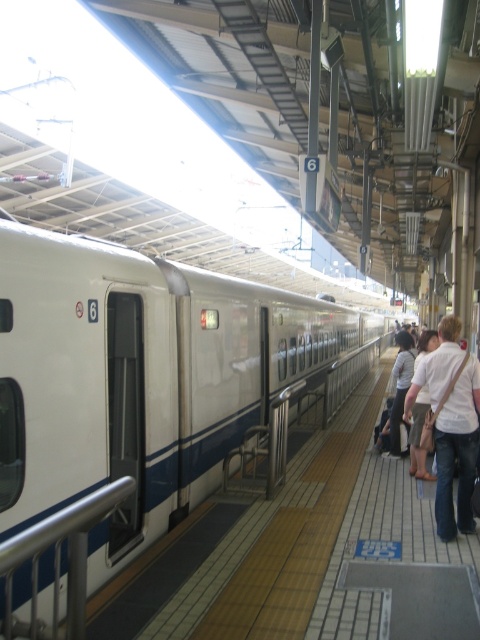
Question: Among these objects, which one is nearest to the camera?

Choices:
 (A) silver metallic rail at lower left
 (B) white glossy train at center
 (C) white cotton shirt at right

Answer: (A)

Question: Is white glossy train at center to the right of silver metallic rail at lower left from the viewer's perspective?

Choices:
 (A) no
 (B) yes

Answer: (A)

Question: Which of the following is the closest to the observer?

Choices:
 (A) silver metallic rail at lower left
 (B) white glossy train at center
 (C) white cotton shirt at right

Answer: (A)

Question: Does silver metallic rail at lower left come in front of white cotton shirt at right?

Choices:
 (A) no
 (B) yes

Answer: (B)

Question: Can you confirm if silver metallic rail at lower left is thinner than white cotton shirt at right?

Choices:
 (A) yes
 (B) no

Answer: (B)

Question: Which of these objects is positioned closest to the silver metallic rail at lower left?

Choices:
 (A) white glossy train at center
 (B) white cotton shirt at right

Answer: (B)